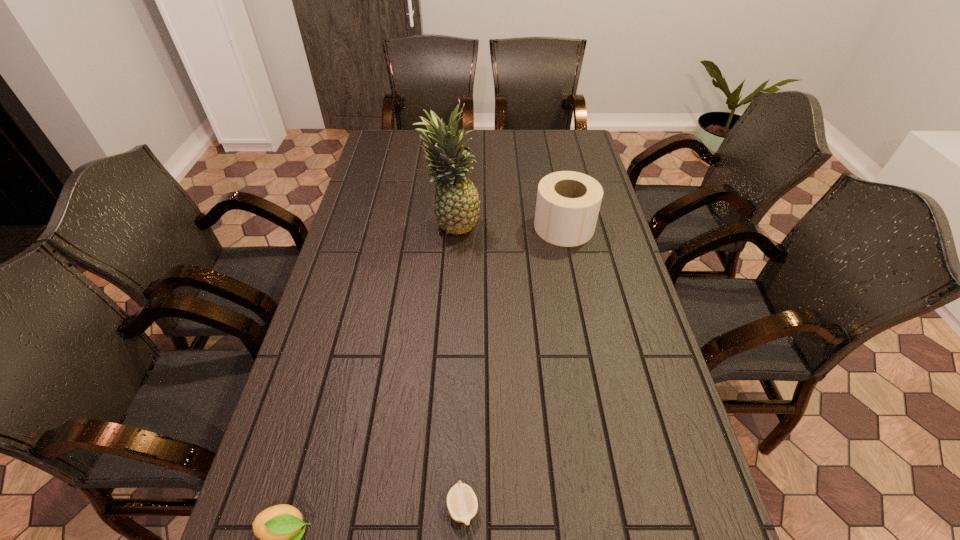
Identify the location of the tallest object. The width and height of the screenshot is (960, 540). point(456,206).

You are a GUI agent. You are given a task and a screenshot of the screen. Output one action in this format:
    pyautogui.click(x=<x>, y=<y>)
    Task: Click on the rightmost object
    Image resolution: width=960 pixels, height=540 pixels.
    Given the screenshot: What is the action you would take?
    pyautogui.click(x=568, y=203)

In order to click on toilet tissue in this screenshot , I will do `click(568, 203)`.

The width and height of the screenshot is (960, 540). I want to click on the right lemon, so click(462, 505).

Where is `the shortest object`? The height and width of the screenshot is (540, 960). the shortest object is located at coordinates (462, 505).

Identify the location of vacant space situated on the left of the tallest object. (373, 224).

The height and width of the screenshot is (540, 960). What are the coordinates of `blank space located on the left of the third shortest object` in the screenshot? It's located at (519, 227).

The height and width of the screenshot is (540, 960). I want to click on free space located 0.340m on the right of the right lemon, so click(x=649, y=508).

Identify the location of object that is at the right edge. The width and height of the screenshot is (960, 540). (568, 203).

Image resolution: width=960 pixels, height=540 pixels. Identify the location of free location at the far edge of the desktop. (539, 153).